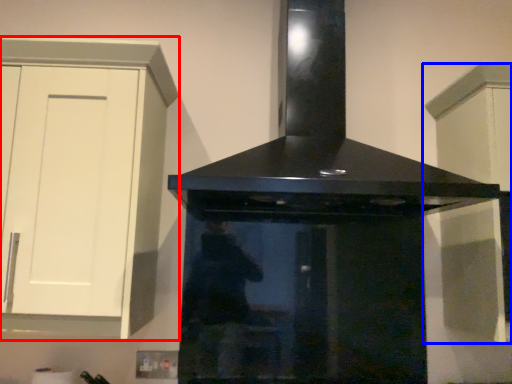
Question: Which object is further to the camera taking this photo, cabinetry (highlighted by a red box) or cabinetry (highlighted by a blue box)?

Choices:
 (A) cabinetry
 (B) cabinetry

Answer: (B)